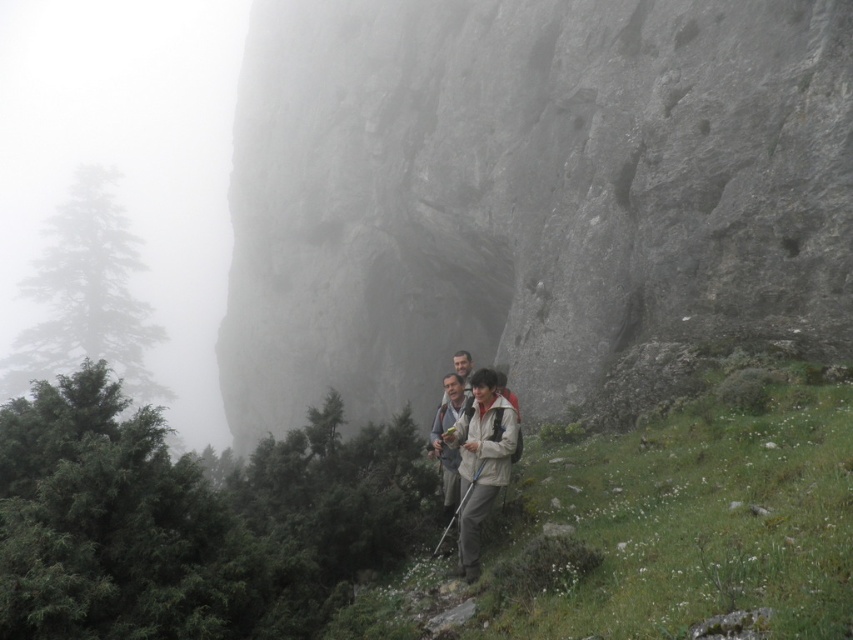
Question: Does rugged stone mountain at center appear on the right side of beige fabric jacket at center?

Choices:
 (A) yes
 (B) no

Answer: (B)

Question: From the image, what is the correct spatial relationship of rugged stone mountain at center in relation to beige fabric jacket at center?

Choices:
 (A) left
 (B) right

Answer: (A)

Question: Can you confirm if rugged stone mountain at center is wider than beige fabric jacket at center?

Choices:
 (A) no
 (B) yes

Answer: (B)

Question: Which of the following is the farthest from the observer?

Choices:
 (A) rugged stone mountain at center
 (B) beige fabric jacket at center

Answer: (A)